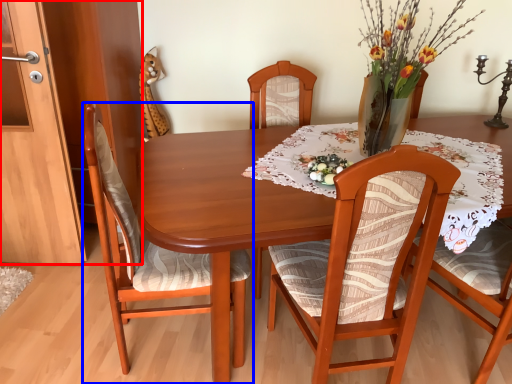
Question: Which object is further to the camera taking this photo, cabinetry (highlighted by a red box) or chair (highlighted by a blue box)?

Choices:
 (A) cabinetry
 (B) chair

Answer: (A)